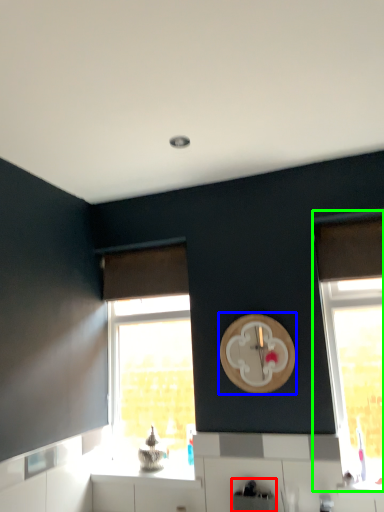
Question: Considering the real-world distances, which object is closest to appliance (highlighted by a red box)? clock (highlighted by a blue box) or window (highlighted by a green box).

Choices:
 (A) clock
 (B) window

Answer: (B)